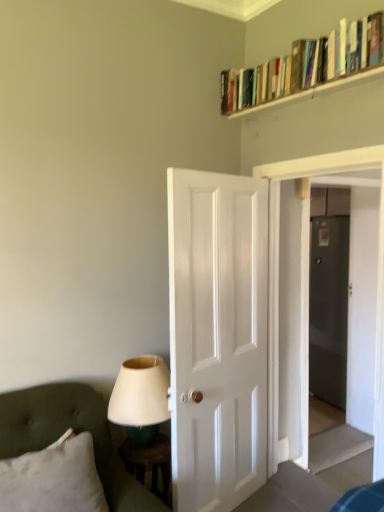
Question: Is the position of wooden bookshelf at upper right more distant than that of wooden stool at lower left?

Choices:
 (A) no
 (B) yes

Answer: (A)

Question: From the image's perspective, does wooden bookshelf at upper right appear higher than wooden stool at lower left?

Choices:
 (A) no
 (B) yes

Answer: (B)

Question: From the image's perspective, is wooden bookshelf at upper right located beneath wooden stool at lower left?

Choices:
 (A) no
 (B) yes

Answer: (A)

Question: Does wooden bookshelf at upper right come in front of wooden stool at lower left?

Choices:
 (A) no
 (B) yes

Answer: (B)

Question: Considering the relative sizes of wooden bookshelf at upper right and wooden stool at lower left in the image provided, is wooden bookshelf at upper right bigger than wooden stool at lower left?

Choices:
 (A) yes
 (B) no

Answer: (B)

Question: Does wooden bookshelf at upper right have a greater height compared to wooden stool at lower left?

Choices:
 (A) no
 (B) yes

Answer: (A)

Question: Is transparent glass door at center, which ranks as the 1th glass door in front-to-back order, inside white matte door at center?

Choices:
 (A) yes
 (B) no

Answer: (B)

Question: Is the depth of white matte door at center less than that of transparent glass door at center, which is the 2th glass door in back-to-front order?

Choices:
 (A) yes
 (B) no

Answer: (A)

Question: Does white matte door at center appear on the left side of transparent glass door at center, which ranks as the 1th glass door in front-to-back order?

Choices:
 (A) no
 (B) yes

Answer: (B)

Question: Can you confirm if white matte door at center is taller than transparent glass door at center, which ranks as the 1th glass door in front-to-back order?

Choices:
 (A) no
 (B) yes

Answer: (A)

Question: Considering the relative sizes of white matte door at center and transparent glass door at center, which ranks as the 1th glass door in front-to-back order, in the image provided, is white matte door at center shorter than transparent glass door at center, which ranks as the 1th glass door in front-to-back order,?

Choices:
 (A) no
 (B) yes

Answer: (B)

Question: Does white matte door at center turn towards transparent glass door at center, which is the 2th glass door in back-to-front order?

Choices:
 (A) no
 (B) yes

Answer: (A)

Question: Is wooden stool at lower left facing away from matte white lampshade at lower left?

Choices:
 (A) no
 (B) yes

Answer: (A)